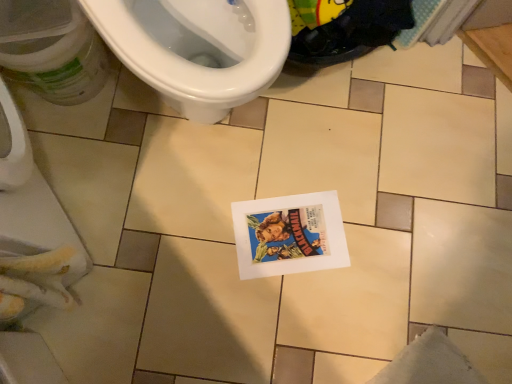
Question: Is white paper comic book at center behind white glossy toilet at upper left?

Choices:
 (A) no
 (B) yes

Answer: (B)

Question: Is white paper comic book at center bigger than white glossy toilet at upper left?

Choices:
 (A) yes
 (B) no

Answer: (B)

Question: Are white paper comic book at center and white glossy toilet at upper left located far from each other?

Choices:
 (A) yes
 (B) no

Answer: (B)

Question: From a real-world perspective, is white paper comic book at center located higher than white glossy toilet at upper left?

Choices:
 (A) yes
 (B) no

Answer: (A)

Question: From a real-world perspective, is white paper comic book at center physically below white glossy toilet at upper left?

Choices:
 (A) no
 (B) yes

Answer: (A)

Question: From the image's perspective, is white glossy toilet at upper left located above or below white glossy toilet at upper left?

Choices:
 (A) below
 (B) above

Answer: (B)

Question: Is white glossy toilet at upper left inside the boundaries of white glossy toilet at upper left, or outside?

Choices:
 (A) outside
 (B) inside

Answer: (A)

Question: From a real-world perspective, is white glossy toilet at upper left positioned above or below white glossy toilet at upper left?

Choices:
 (A) below
 (B) above

Answer: (B)

Question: Considering the relative positions of white glossy toilet at upper left and white glossy toilet at upper left in the image provided, is white glossy toilet at upper left to the left or to the right of white glossy toilet at upper left?

Choices:
 (A) left
 (B) right

Answer: (B)

Question: In terms of size, does white glossy toilet at upper left appear bigger or smaller than white paper comic book at center?

Choices:
 (A) small
 (B) big

Answer: (B)

Question: Is white glossy toilet at upper left taller or shorter than white paper comic book at center?

Choices:
 (A) short
 (B) tall

Answer: (B)

Question: Looking at their shapes, would you say white glossy toilet at upper left is wider or thinner than white paper comic book at center?

Choices:
 (A) wide
 (B) thin

Answer: (A)

Question: Which is correct: white glossy toilet at upper left is inside white paper comic book at center, or outside of it?

Choices:
 (A) outside
 (B) inside

Answer: (A)

Question: Relative to white glossy toilet at upper left, is white glossy toilet at upper left in front or behind?

Choices:
 (A) behind
 (B) front

Answer: (A)

Question: Is white glossy toilet at upper left wider or thinner than white glossy toilet at upper left?

Choices:
 (A) wide
 (B) thin

Answer: (B)